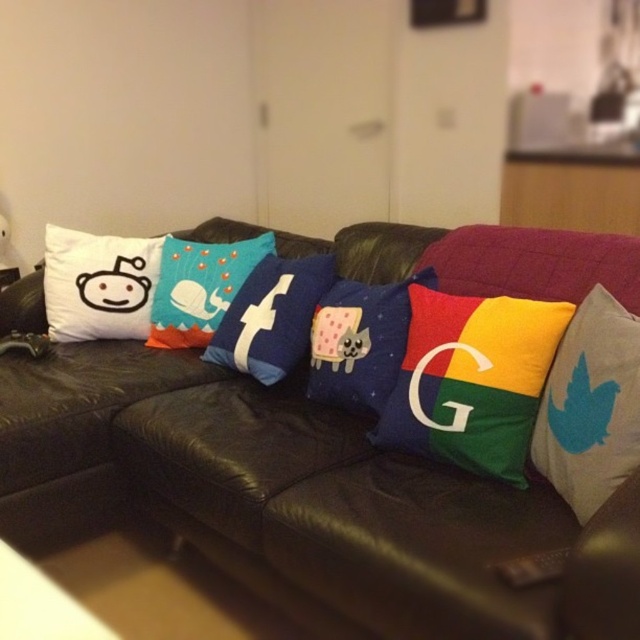
Is black leather couch at center thinner than white fabric pillow with reddit logo at left?

No, black leather couch at center is not thinner than white fabric pillow with reddit logo at left.

Is black leather couch at center shorter than white fabric pillow with reddit logo at left?

No, black leather couch at center is not shorter than white fabric pillow with reddit logo at left.

This screenshot has height=640, width=640. Identify the location of black leather couch at center. (269, 493).

This screenshot has height=640, width=640. I want to click on black leather couch at center, so click(269, 493).

Which of these two, white fabric twitter bird at right or teal fabric whale at center, stands shorter?

teal fabric whale at center

Looking at this image, measure the distance between white fabric twitter bird at right and teal fabric whale at center.

They are 1.35 meters apart.

Where is `white fabric twitter bird at right`? white fabric twitter bird at right is located at coordinates [x=589, y=404].

Where is `white fabric twitter bird at right`? The image size is (640, 640). white fabric twitter bird at right is located at coordinates (589, 404).

Can you confirm if white fabric pillow with reddit logo at left is positioned below teal fabric whale at center?

Indeed, white fabric pillow with reddit logo at left is positioned under teal fabric whale at center.

Describe the element at coordinates (99, 284) in the screenshot. I see `white fabric pillow with reddit logo at left` at that location.

This screenshot has height=640, width=640. What do you see at coordinates (99, 284) in the screenshot?
I see `white fabric pillow with reddit logo at left` at bounding box center [99, 284].

Where is `white fabric pillow with reddit logo at left`? The width and height of the screenshot is (640, 640). white fabric pillow with reddit logo at left is located at coordinates (99, 284).